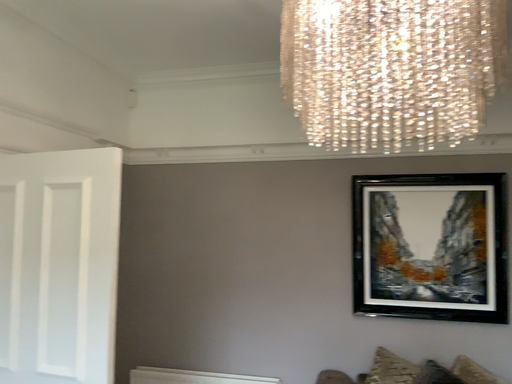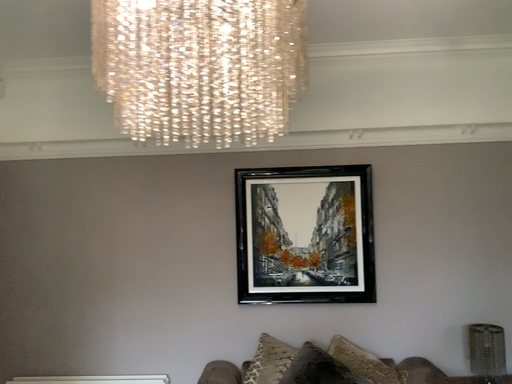
Question: How did the camera likely rotate when shooting the video?

Choices:
 (A) rotated left
 (B) rotated right

Answer: (B)